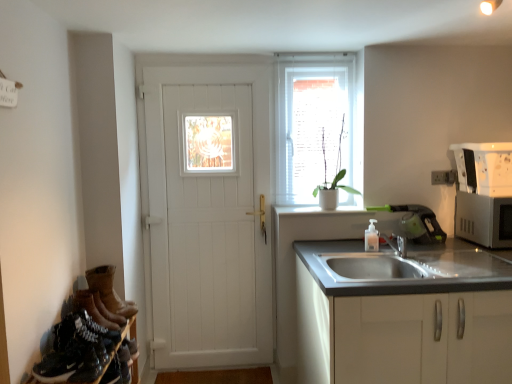
Find the location of a particular element. vacant space situated above white matte window at center (from a real-world perspective) is located at coordinates (310, 59).